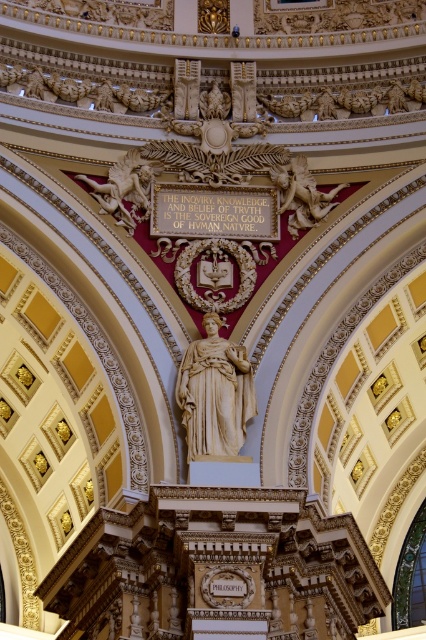
You are an art conservator assessing the space. You need to determine if a new lighting fixture, which requires a minimum height clearance of 3 meters, can be installed above the white marble statue at center and the white marble winged horse at upper left. Based on their heights, can the fixture be safely installed?

The white marble statue at center is not as tall as the white marble winged horse at upper left, but without specific height measurements, it is impossible to determine if the 3 meter clearance requirement is met. Additional measurements are needed.

You are an architect designing a new museum exhibit and need to ensure that the white marble statue at center and the matte gold cherub at upper center are visible from the main entrance. Based on their sizes, which object might require a larger viewing area to be fully appreciated?

The matte gold cherub at upper center requires a larger viewing area because it occupies more space than the white marble statue at center.